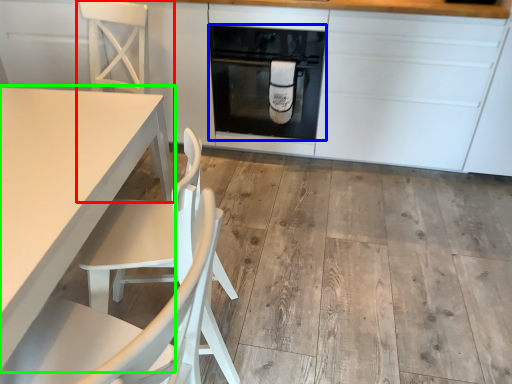
Question: Estimate the real-world distances between objects in this image. Which object is closer to chair (highlighted by a red box), home appliance (highlighted by a blue box) or table (highlighted by a green box)?

Choices:
 (A) home appliance
 (B) table

Answer: (A)